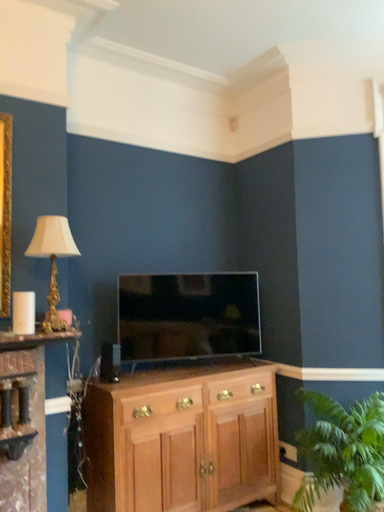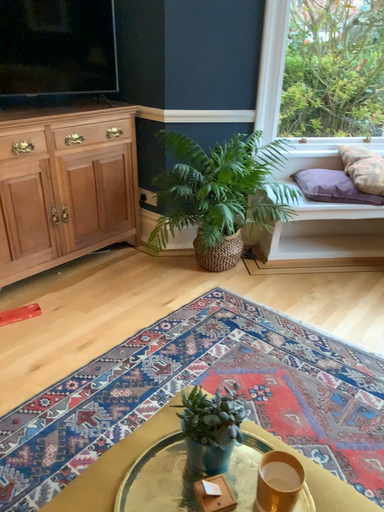
Question: Which way did the camera rotate in the video?

Choices:
 (A) rotated left
 (B) rotated right

Answer: (B)